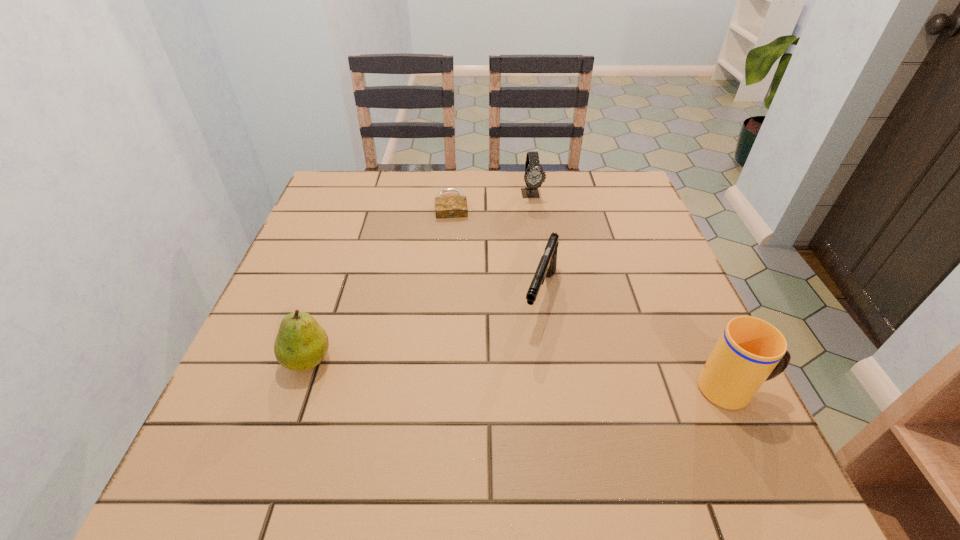
Select which object appears as the closest to the pear. Please provide its 2D coordinates. Your answer should be formatted as a tuple, i.e. [(x, y)], where the tuple contains the x and y coordinates of a point satisfying the conditions above.

[(546, 268)]

The width and height of the screenshot is (960, 540). I want to click on blank space that satisfies the following two spatial constraints: 1. on the front side of the rightmost object; 2. on the side of the watch with the handle, so [563, 389].

The image size is (960, 540). Find the location of `vacant space that satisfies the following two spatial constraints: 1. on the back side of the gun; 2. on the right side of the pear`. vacant space that satisfies the following two spatial constraints: 1. on the back side of the gun; 2. on the right side of the pear is located at coordinates (330, 296).